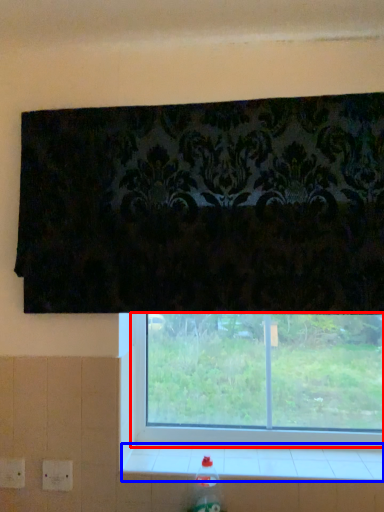
Question: Which object appears farthest to the camera in this image, window (highlighted by a red box) or window sill (highlighted by a blue box)?

Choices:
 (A) window
 (B) window sill

Answer: (A)